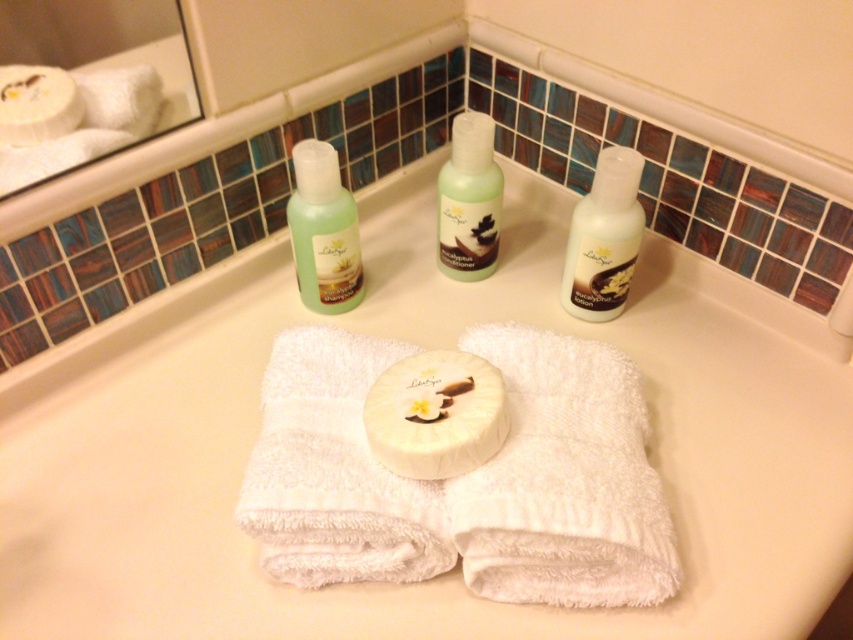
Consider the image. You are organizing the bathroom countertop and need to place a new item between the white matte soap at center and the green translucent shampoo at upper center. Which item should you place closer to the edge of the countertop to ensure stability?

The white matte soap at center is smaller than the green translucent shampoo at upper center. To ensure stability, place the larger item, the green translucent shampoo at upper center, closer to the edge of the countertop since it has a larger base and is less likely to tip over.

You are organizing the bathroom countertop and want to arrange the satin white lotion at right and the translucent plastic bottle at center vertically in order of height from shortest to tallest. Based on their positions, which one should come first?

The satin white lotion at right is shorter than the translucent plastic bottle at center, so it should come first in the order from shortest to tallest.

You are organizing the bathroom countertop and want to place a new toothbrush holder behind the translucent plastic bottle at center. Can you place it there without moving the satin white lotion at right?

The satin white lotion at right is in front of the translucent plastic bottle at center, so moving the translucent plastic bottle at center would require moving the satin white lotion at right first. Therefore, you cannot place the toothbrush holder behind the translucent plastic bottle at center without moving the satin white lotion at right.